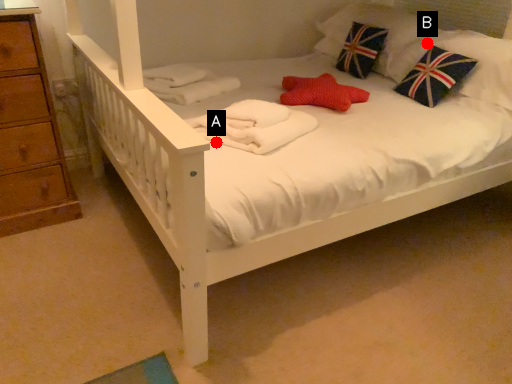
Question: Two points are circled on the image, labeled by A and B beside each circle. Which point appears farthest from the camera in this image?

Choices:
 (A) A is further
 (B) B is further

Answer: (B)